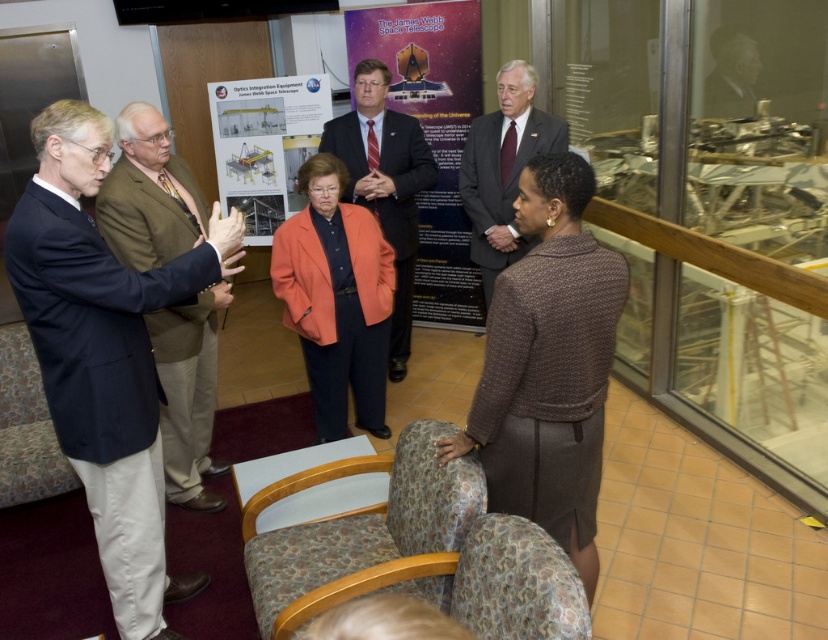
Which is more to the left, orange fabric jacket at center or patterned fabric chair at lower center?

orange fabric jacket at center

This screenshot has height=640, width=828. In order to click on orange fabric jacket at center in this screenshot , I will do `click(335, 300)`.

Can you confirm if dark blue suit at left is shorter than patterned fabric chair at lower center?

No.

Is point (61, 184) positioned in front of point (456, 518)?

No, (61, 184) is behind (456, 518).

This screenshot has height=640, width=828. What are the coordinates of `dark blue suit at left` in the screenshot? It's located at (104, 353).

What do you see at coordinates (384, 184) in the screenshot? This screenshot has height=640, width=828. I see `matte black suit at center` at bounding box center [384, 184].

Identify the location of matte black suit at center. The image size is (828, 640). (384, 184).